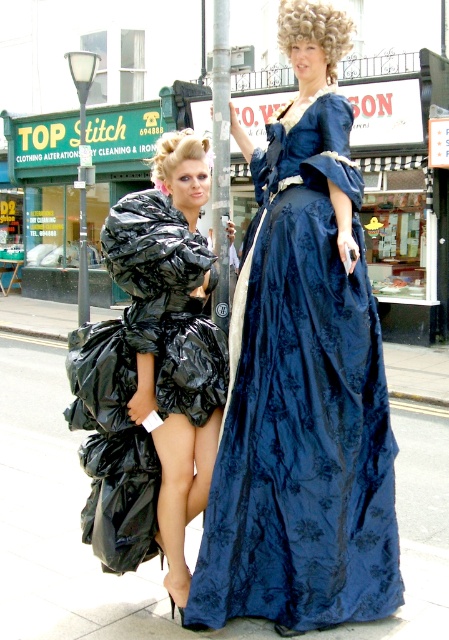
Question: Where is metallic silver pole at center located in relation to blonde curly wig at upper center in the image?

Choices:
 (A) above
 (B) below

Answer: (B)

Question: Can you confirm if smooth concrete pavement at center is smaller than blonde synthetic wig at center?

Choices:
 (A) yes
 (B) no

Answer: (A)

Question: Which object is closer to the camera taking this photo?

Choices:
 (A) velvet blue gown at center
 (B) black plastic bags at left
 (C) smooth concrete pavement at center
 (D) blonde curly wig at upper center

Answer: (B)

Question: Does smooth concrete pavement at center appear on the left side of metallic silver pole at center?

Choices:
 (A) no
 (B) yes

Answer: (B)

Question: Among these points, which one is nearest to the camera?

Choices:
 (A) (52, 352)
 (B) (157, 176)
 (C) (210, 499)
 (D) (224, 148)

Answer: (C)

Question: Which point is closer to the camera?

Choices:
 (A) metallic silver pole at center
 (B) blonde curly wig at upper center

Answer: (B)